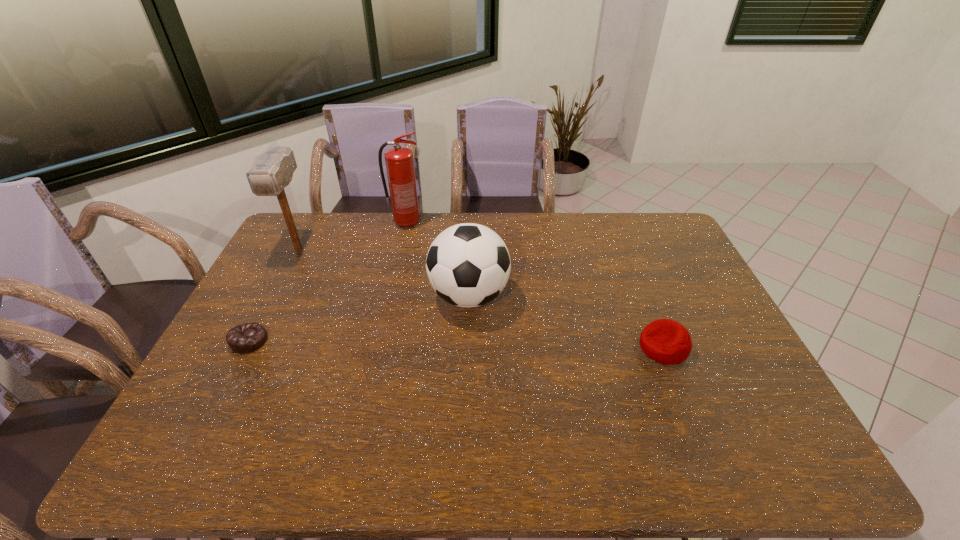
Where is `the third object from right to left`? the third object from right to left is located at coordinates (399, 160).

Image resolution: width=960 pixels, height=540 pixels. I want to click on the farthest object, so click(x=399, y=160).

You are a GUI agent. You are given a task and a screenshot of the screen. Output one action in this format:
    pyautogui.click(x=<x>, y=<y>)
    Task: Click on the second farthest object
    
    Given the screenshot: What is the action you would take?
    point(271,171)

Identify the location of the second object from right to left. (468, 265).

At what (x,y) coordinates should I click in order to perform the action: click on soccer ball. Please return your answer as a coordinate pair (x, y). The width and height of the screenshot is (960, 540). Looking at the image, I should click on (468, 265).

This screenshot has width=960, height=540. What are the coordinates of `the taller beanbag` in the screenshot? It's located at (665, 341).

Where is `the fourth tallest object`? the fourth tallest object is located at coordinates (665, 341).

Locate an element on the screen. the left beanbag is located at coordinates (246, 338).

Locate an element on the screen. The height and width of the screenshot is (540, 960). the shorter beanbag is located at coordinates (246, 338).

At what (x,y) coordinates should I click in order to perform the action: click on vacant region located on the handle side the farthest object. Please return your answer as a coordinate pair (x, y). The height and width of the screenshot is (540, 960). Looking at the image, I should click on coord(500,223).